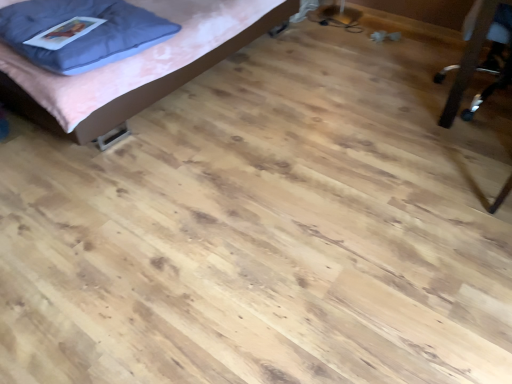
I want to click on vacant area located to the right-hand side of matte pink bed at upper left, so click(x=347, y=89).